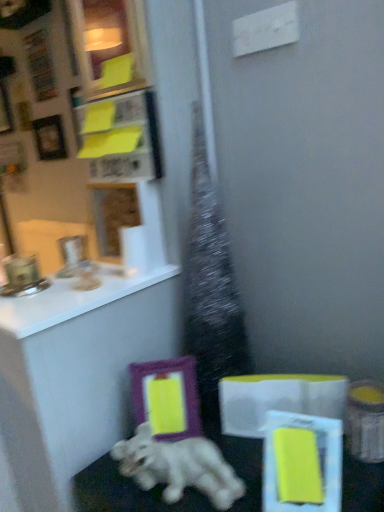
Question: Would you say white glossy dog at lower center contains yellow paper at upper left?

Choices:
 (A) no
 (B) yes

Answer: (A)

Question: From the image's perspective, does white glossy dog at lower center appear lower than yellow paper at upper left?

Choices:
 (A) yes
 (B) no

Answer: (A)

Question: Is white glossy dog at lower center in front of yellow paper at upper left?

Choices:
 (A) yes
 (B) no

Answer: (A)

Question: From a real-world perspective, is white glossy dog at lower center located higher than yellow paper at upper left?

Choices:
 (A) yes
 (B) no

Answer: (B)

Question: Is white glossy dog at lower center further to the viewer compared to yellow paper at upper left?

Choices:
 (A) no
 (B) yes

Answer: (A)

Question: From the image's perspective, is white glossy dog at lower center on yellow paper at upper left?

Choices:
 (A) yes
 (B) no

Answer: (B)

Question: Considering the relative sizes of matte purple picture frame at upper left, which is the first picture frame from left to right, and white glossy countertop at upper left in the image provided, is matte purple picture frame at upper left, which is the first picture frame from left to right, shorter than white glossy countertop at upper left?

Choices:
 (A) yes
 (B) no

Answer: (B)

Question: Considering the relative positions of matte purple picture frame at upper left, positioned as the 4th picture frame in front-to-back order, and white glossy countertop at upper left in the image provided, is matte purple picture frame at upper left, positioned as the 4th picture frame in front-to-back order, in front of white glossy countertop at upper left?

Choices:
 (A) yes
 (B) no

Answer: (B)

Question: Is matte purple picture frame at upper left, which is the fourth picture frame in right-to-left order, smaller than white glossy countertop at upper left?

Choices:
 (A) yes
 (B) no

Answer: (A)

Question: From the image's perspective, is matte purple picture frame at upper left, positioned as the 4th picture frame in front-to-back order, on top of white glossy countertop at upper left?

Choices:
 (A) yes
 (B) no

Answer: (A)

Question: Is matte purple picture frame at upper left, the first picture frame when ordered from top to bottom, next to white glossy countertop at upper left and touching it?

Choices:
 (A) no
 (B) yes

Answer: (A)

Question: From the image's perspective, is matte purple picture frame at upper left, the first picture frame when ordered from top to bottom, located beneath white glossy countertop at upper left?

Choices:
 (A) yes
 (B) no

Answer: (B)

Question: Is matte yellow picture frame at upper left, the 2th picture frame in the right-to-left sequence, oriented towards white glossy countertop at upper left?

Choices:
 (A) no
 (B) yes

Answer: (A)